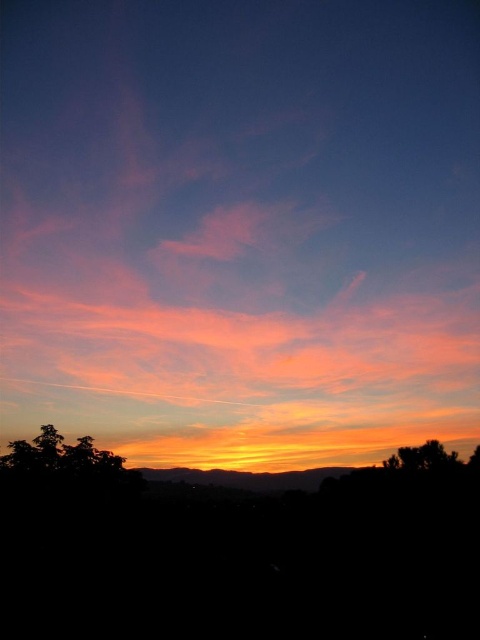
Question: Which object appears closest to the camera in this image?

Choices:
 (A) pink translucent cloud at upper center
 (B) green leafy tree at lower right
 (C) silhouette tree at lower left

Answer: (A)

Question: Can you confirm if pink translucent cloud at upper center is positioned to the left of silhouette tree at lower left?

Choices:
 (A) no
 (B) yes

Answer: (A)

Question: Among these objects, which one is nearest to the camera?

Choices:
 (A) green leafy tree at lower right
 (B) pink translucent cloud at upper center
 (C) silhouette tree at lower left

Answer: (B)

Question: Which point is closer to the camera taking this photo?

Choices:
 (A) (245, 280)
 (B) (70, 452)
 (C) (391, 458)

Answer: (B)

Question: Is pink translucent cloud at upper center to the right of silhouette tree at lower left from the viewer's perspective?

Choices:
 (A) yes
 (B) no

Answer: (A)

Question: Does silhouette tree at lower left appear under green leafy tree at lower right?

Choices:
 (A) yes
 (B) no

Answer: (B)